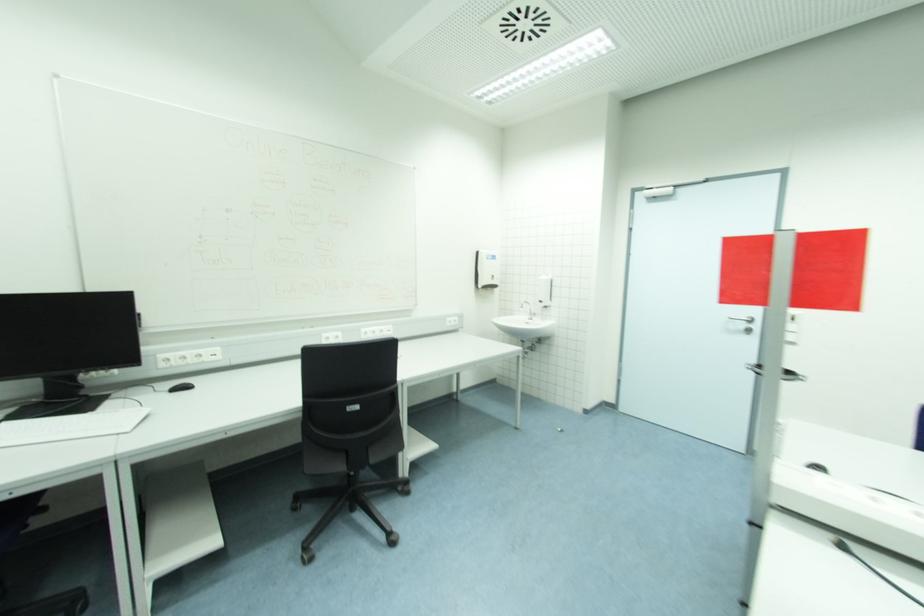
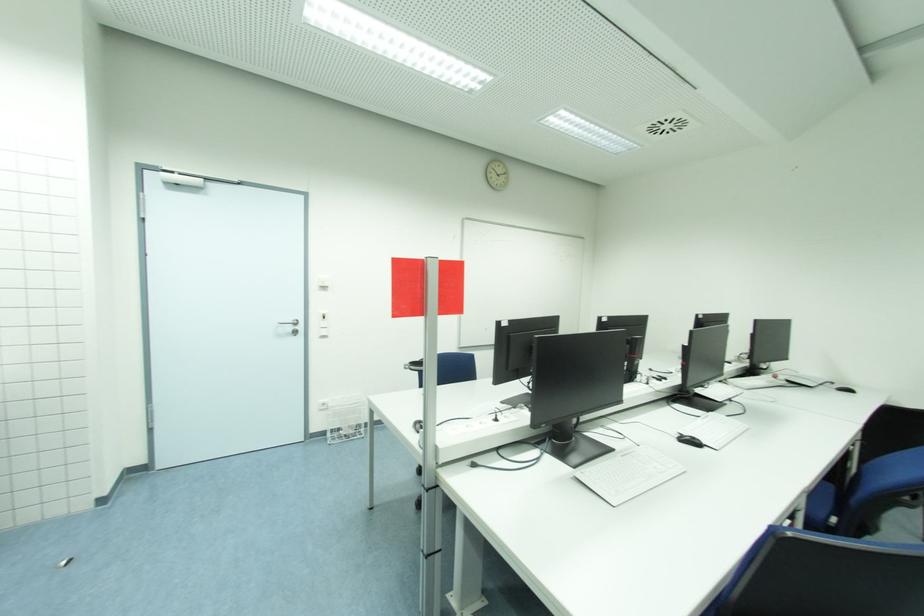
Question: The camera is either moving clockwise (left) or counter-clockwise (right) around the object. The first image is from the beginning of the video and the second image is from the end. Is the camera moving left or right when shooting the video?

Choices:
 (A) Left
 (B) Right

Answer: (A)